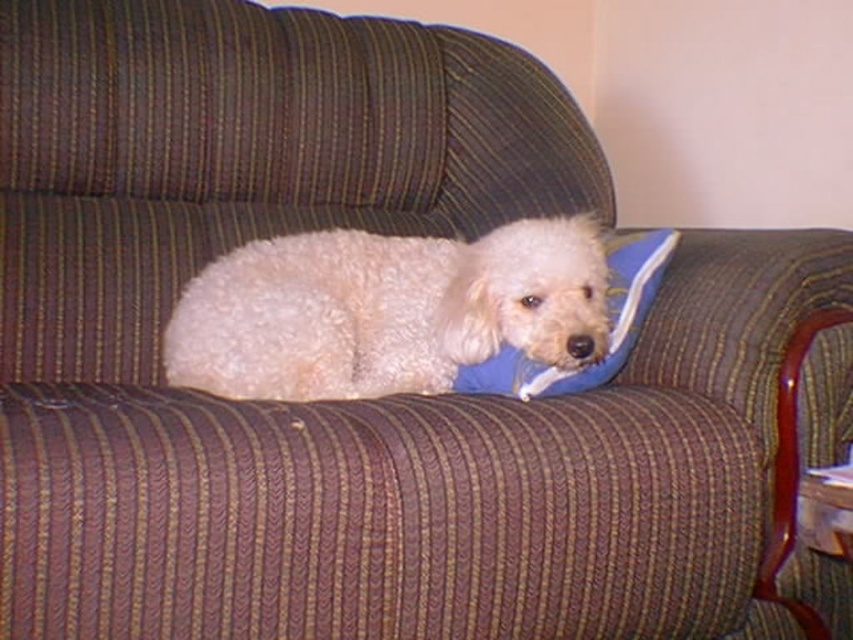
You are a photographer trying to capture the white fluffy dog at center and the blue fabric pillow at center in the same frame. Which object is positioned closer to the camera?

The white fluffy dog at center is closer to the camera than the blue fabric pillow at center.

You are trying to decide if the blue fabric pillow at center can fit on a shelf that can hold items up to the size of the white fluffy dog at center. Based on their sizes, will the pillow fit?

The white fluffy dog at center is larger than the blue fabric pillow at center, so the pillow will fit on the shelf designed for the dog.

You are a photographer trying to capture a closeup shot of the white fluffy dog at center. Your camera has a minimum focusing distance of 1 meter. Can you take the photo without moving the dog?

The white fluffy dog at center is 1.27 meters away from the camera, which is beyond the minimum focusing distance of 1 meter. Therefore, you can take the closeup shot without needing to move the dog.